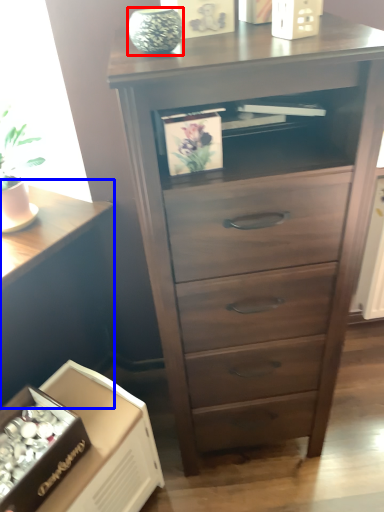
Question: Which point is further to the camera, glass vase (highlighted by a red box) or table (highlighted by a blue box)?

Choices:
 (A) glass vase
 (B) table

Answer: (B)